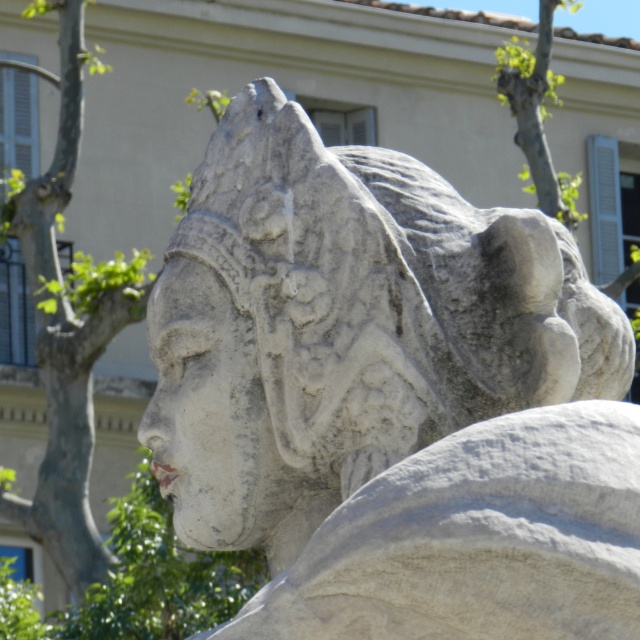
Between point (228, 337) and point (60, 202), which one is positioned in front?

Positioned in front is point (228, 337).

Does white stone head at center appear on the right side of green leafy tree at left?

Yes, white stone head at center is to the right of green leafy tree at left.

Is point (268, 97) closer to viewer compared to point (20, 212)?

Yes, it is.

Where is `white stone head at center`? Image resolution: width=640 pixels, height=640 pixels. white stone head at center is located at coordinates (294, 330).